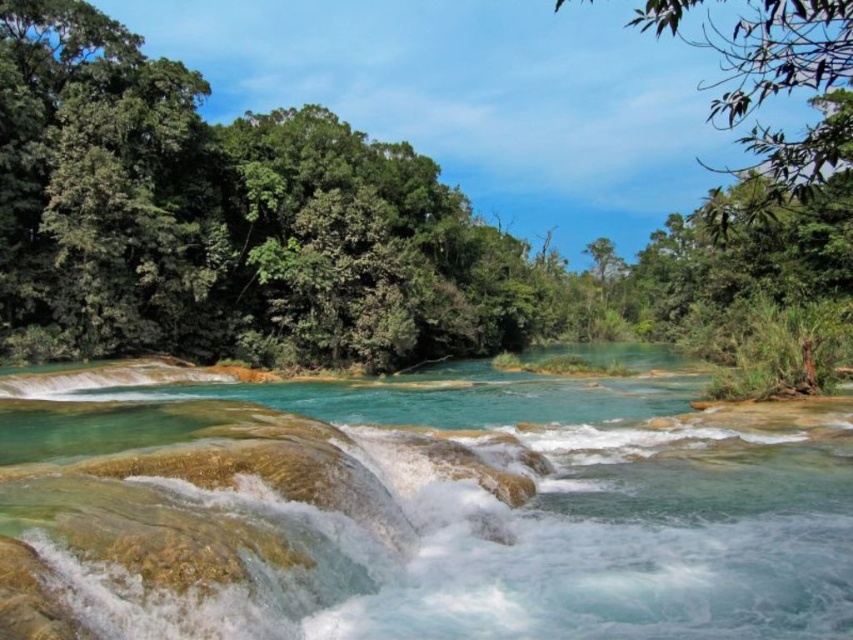
Question: Does clear water at center appear on the left side of green leafy tree at upper right?

Choices:
 (A) no
 (B) yes

Answer: (B)

Question: Which object is farther from the camera taking this photo?

Choices:
 (A) green leafy tree at center
 (B) green leafy tree at upper right
 (C) clear water at center

Answer: (A)

Question: Is clear water at center behind green leafy tree at upper right?

Choices:
 (A) no
 (B) yes

Answer: (A)

Question: Does clear water at center have a smaller size compared to green leafy tree at upper right?

Choices:
 (A) no
 (B) yes

Answer: (B)

Question: Which of these objects is positioned farthest from the green leafy tree at upper right?

Choices:
 (A) clear water at center
 (B) green leafy tree at center

Answer: (A)

Question: Based on their relative distances, which object is farther from the green leafy tree at upper right?

Choices:
 (A) green leafy tree at center
 (B) clear water at center

Answer: (B)